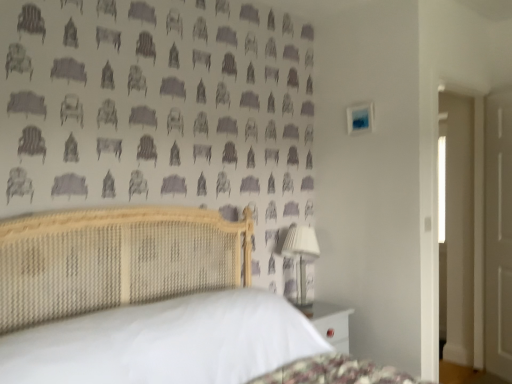
Question: Is there a large distance between white matte door at right and white fabric-covered lampshade at right?

Choices:
 (A) no
 (B) yes

Answer: (B)

Question: From the image's perspective, is white matte door at right located above white fabric-covered lampshade at right?

Choices:
 (A) no
 (B) yes

Answer: (B)

Question: Is white matte door at right oriented away from white fabric-covered lampshade at right?

Choices:
 (A) no
 (B) yes

Answer: (A)

Question: From a real-world perspective, is white matte door at right below white fabric-covered lampshade at right?

Choices:
 (A) yes
 (B) no

Answer: (B)

Question: Is white fabric-covered lampshade at right located within white matte door at right?

Choices:
 (A) yes
 (B) no

Answer: (B)

Question: Considering the positions of white fabric-covered lampshade at right and white matte door at right in the image, is white fabric-covered lampshade at right wider or thinner than white matte door at right?

Choices:
 (A) wide
 (B) thin

Answer: (A)

Question: Based on their positions, is white fabric-covered lampshade at right located to the left or right of white matte door at right?

Choices:
 (A) right
 (B) left

Answer: (B)

Question: Is point (283, 253) positioned closer to the camera than point (485, 259)?

Choices:
 (A) farther
 (B) closer

Answer: (B)

Question: From a real-world perspective, is white fabric-covered lampshade at right above or below white matte door at right?

Choices:
 (A) below
 (B) above

Answer: (A)

Question: Do you think white matte door at right is within woven wood bed at center, or outside of it?

Choices:
 (A) outside
 (B) inside

Answer: (A)

Question: In the image, is white matte door at right positioned in front of or behind woven wood bed at center?

Choices:
 (A) behind
 (B) front

Answer: (A)

Question: In terms of width, does white matte door at right look wider or thinner when compared to woven wood bed at center?

Choices:
 (A) thin
 (B) wide

Answer: (A)

Question: Is point (496, 198) positioned closer to the camera than point (50, 339)?

Choices:
 (A) closer
 (B) farther

Answer: (B)

Question: Would you say white fabric-covered lampshade at right is inside or outside woven wood bed at center?

Choices:
 (A) outside
 (B) inside

Answer: (A)

Question: From their relative heights in the image, would you say white fabric-covered lampshade at right is taller or shorter than woven wood bed at center?

Choices:
 (A) short
 (B) tall

Answer: (A)